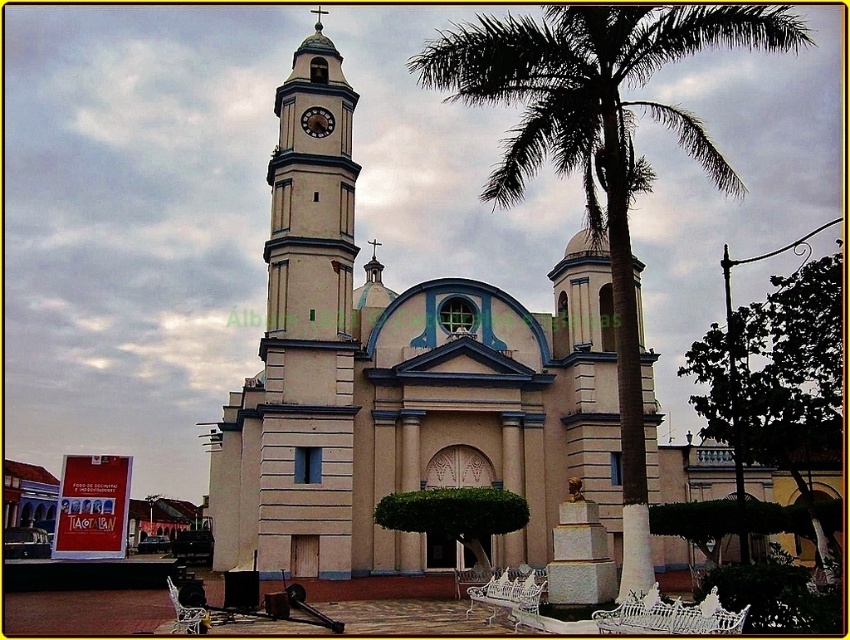
Question: Which object is closer to the camera taking this photo?

Choices:
 (A) green leafy palm tree at center
 (B) white smooth clock tower at upper left
 (C) wooden clock at center

Answer: (A)

Question: Is white smooth clock tower at upper left to the left of wooden clock at center from the viewer's perspective?

Choices:
 (A) no
 (B) yes

Answer: (B)

Question: Among these objects, which one is nearest to the camera?

Choices:
 (A) white smooth clock tower at upper left
 (B) wooden clock at center

Answer: (A)

Question: Is green leafy palm tree at center to the right of white smooth clock tower at upper left from the viewer's perspective?

Choices:
 (A) no
 (B) yes

Answer: (B)

Question: Estimate the real-world distances between objects in this image. Which object is farther from the white smooth clock tower at upper left?

Choices:
 (A) green leafy palm tree at center
 (B) wooden clock at center

Answer: (A)

Question: Is green leafy palm tree at center thinner than white smooth clock tower at upper left?

Choices:
 (A) yes
 (B) no

Answer: (B)